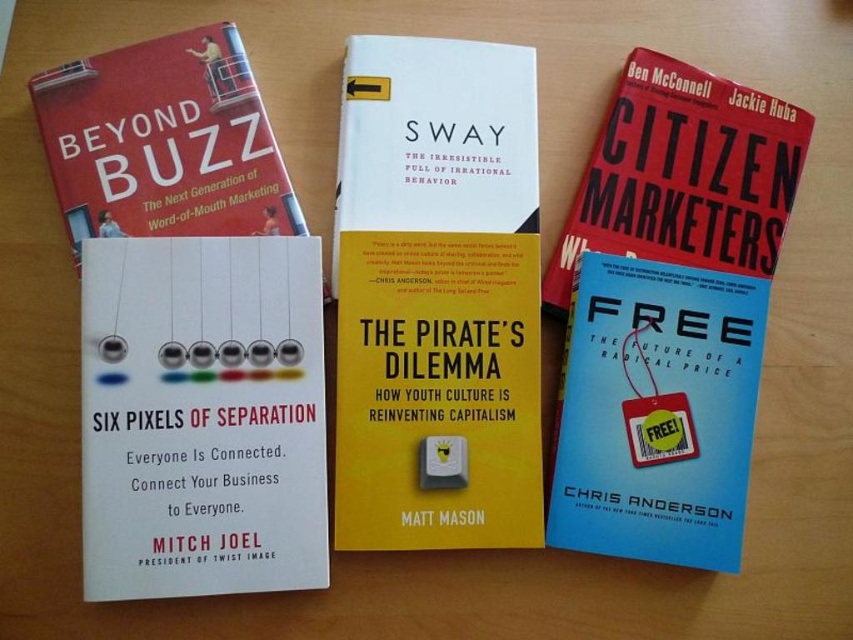
Question: Is yellow matte book at center bigger than matte red book at upper left?

Choices:
 (A) no
 (B) yes

Answer: (B)

Question: Which point is closer to the camera?

Choices:
 (A) (577, 209)
 (B) (372, 419)
 (C) (90, 112)

Answer: (B)

Question: Which is nearer to the yellow matte book at center?

Choices:
 (A) blue matte book at center
 (B) matte red book at upper left

Answer: (A)

Question: From the image, what is the correct spatial relationship of yellow matte book at center in relation to matte red book at upper left?

Choices:
 (A) below
 (B) above

Answer: (A)

Question: Which point is closer to the camera?

Choices:
 (A) matte red book at upper left
 (B) blue matte book at center
 (C) yellow matte book at center

Answer: (C)

Question: Is yellow matte book at center behind blue matte book at center?

Choices:
 (A) no
 (B) yes

Answer: (A)